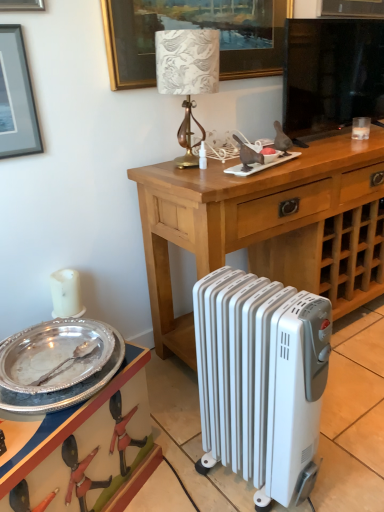
Where is `vacant region in front of gold metallic lampshade at center`? The image size is (384, 512). vacant region in front of gold metallic lampshade at center is located at coordinates (204, 176).